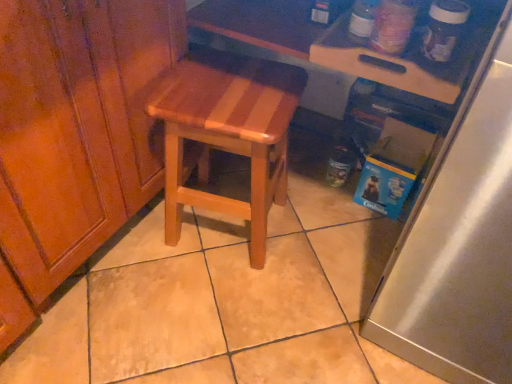
Question: Does wooden at center have a smaller size compared to satin silver refrigerator at right?

Choices:
 (A) no
 (B) yes

Answer: (B)

Question: Are wooden at center and satin silver refrigerator at right making contact?

Choices:
 (A) yes
 (B) no

Answer: (B)

Question: From a real-world perspective, does wooden at center sit lower than satin silver refrigerator at right?

Choices:
 (A) yes
 (B) no

Answer: (A)

Question: Is wooden at center far from satin silver refrigerator at right?

Choices:
 (A) yes
 (B) no

Answer: (B)

Question: Is wooden at center not within satin silver refrigerator at right?

Choices:
 (A) yes
 (B) no

Answer: (A)

Question: From the image's perspective, is wooden at center beneath satin silver refrigerator at right?

Choices:
 (A) yes
 (B) no

Answer: (B)

Question: From a real-world perspective, does satin silver refrigerator at right stand above wooden at center?

Choices:
 (A) yes
 (B) no

Answer: (A)

Question: Is satin silver refrigerator at right positioned far away from wooden at center?

Choices:
 (A) yes
 (B) no

Answer: (B)

Question: Is satin silver refrigerator at right bigger than wooden at center?

Choices:
 (A) no
 (B) yes

Answer: (B)

Question: Is satin silver refrigerator at right smaller than wooden at center?

Choices:
 (A) no
 (B) yes

Answer: (A)

Question: Can you confirm if satin silver refrigerator at right is wider than wooden at center?

Choices:
 (A) no
 (B) yes

Answer: (B)

Question: Is satin silver refrigerator at right not inside wooden at center?

Choices:
 (A) no
 (B) yes

Answer: (B)

Question: Is wooden cutting board at upper right to the left of wooden at center from the viewer's perspective?

Choices:
 (A) no
 (B) yes

Answer: (A)